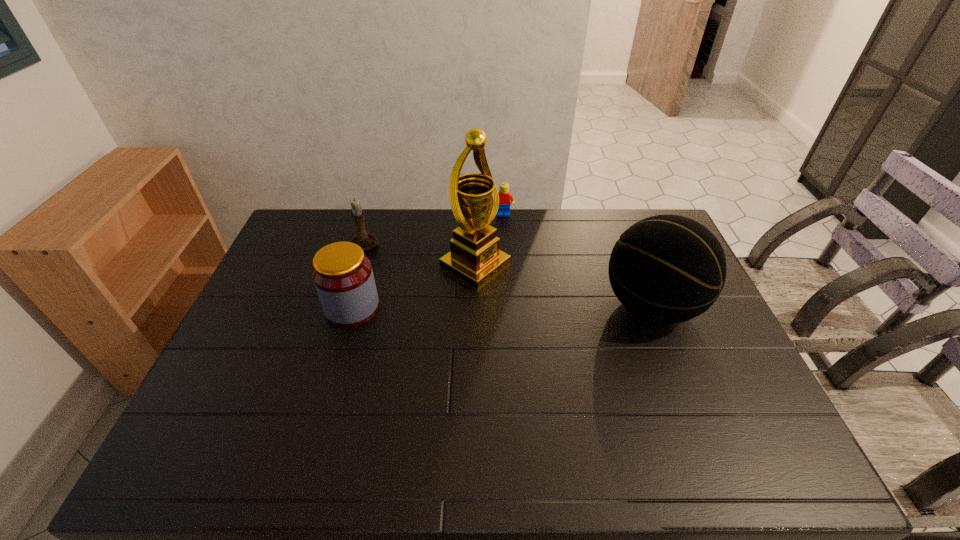
I want to click on jar, so click(x=342, y=274).

This screenshot has height=540, width=960. I want to click on the fourth shortest object, so click(668, 269).

At what (x,y) coordinates should I click in order to perform the action: click on the rightmost object. Please return your answer as a coordinate pair (x, y). The image size is (960, 540). Looking at the image, I should click on (668, 269).

Locate an element on the screen. This screenshot has width=960, height=540. candle holder is located at coordinates (366, 240).

This screenshot has width=960, height=540. Find the location of `the tallest object`. the tallest object is located at coordinates (474, 258).

This screenshot has width=960, height=540. What are the coordinates of `Lego` in the screenshot? It's located at (505, 196).

You are a GUI agent. You are given a task and a screenshot of the screen. Output one action in this format:
    pyautogui.click(x=<x>, y=<y>)
    Task: Click on the shortest object
    This screenshot has height=540, width=960.
    Given the screenshot: What is the action you would take?
    pyautogui.click(x=505, y=196)

I want to click on free spot located 0.180m on the front of the jar, so click(x=331, y=382).

Where is `free region located on the left of the rightmost object`? The image size is (960, 540). free region located on the left of the rightmost object is located at coordinates (475, 306).

I want to click on free location located on the side of the candle holder with the handle, so click(x=412, y=274).